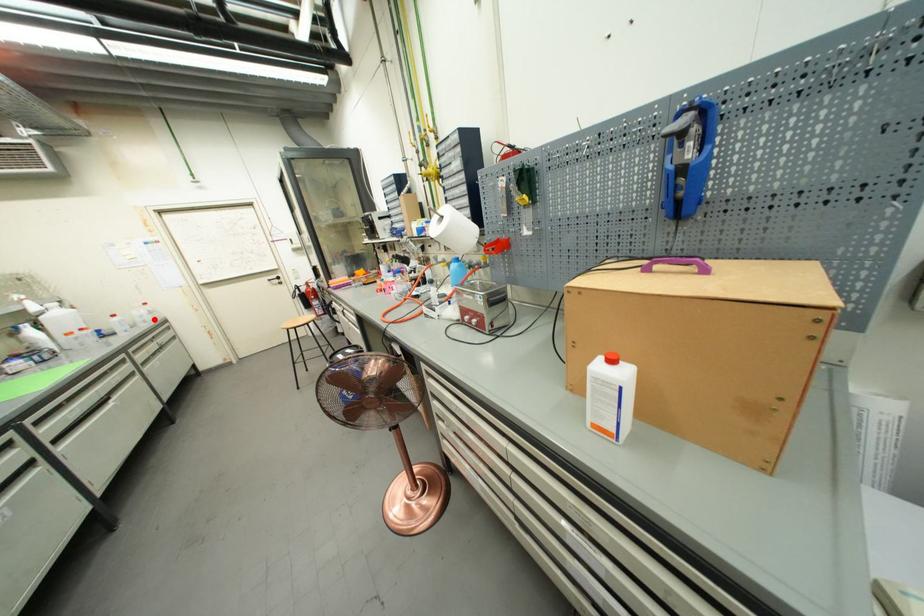
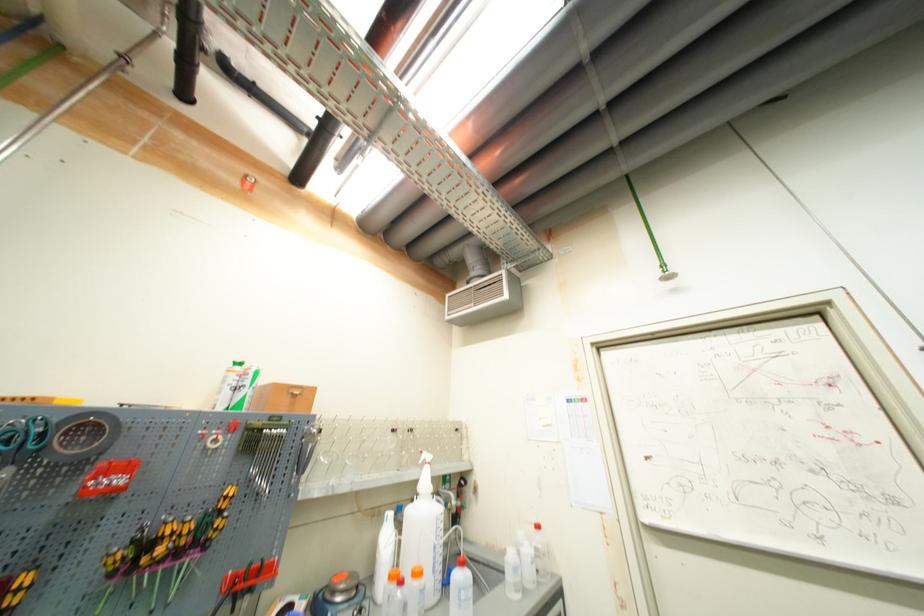
Find the pixel in the second image that matches the highlighted location in the first image.

(533, 578)